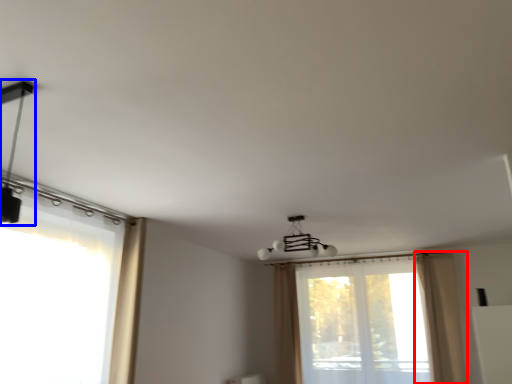
Question: Which of the following is the closest to the observer, curtain (highlighted by a red box) or lamp (highlighted by a blue box)?

Choices:
 (A) curtain
 (B) lamp

Answer: (B)